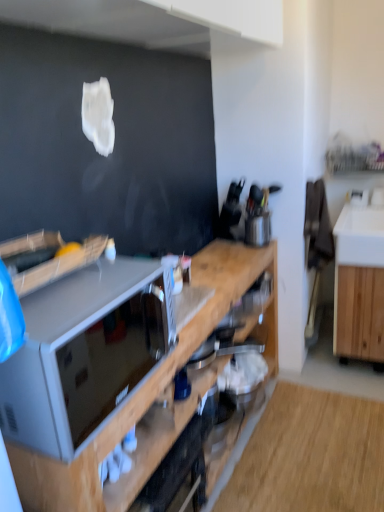
Question: From the image's perspective, is wooden cabinet at center, which appears as the first cabinetry when viewed from the left, above or below wooden cabinet at right, positioned as the 2th cabinetry in left-to-right order?

Choices:
 (A) above
 (B) below

Answer: (B)

Question: Is wooden cabinet at center, placed as the second cabinetry when sorted from right to left, taller or shorter than wooden cabinet at right, positioned as the 2th cabinetry in left-to-right order?

Choices:
 (A) short
 (B) tall

Answer: (B)

Question: Which object is positioned farthest from the wooden cabinet at center, which appears as the first cabinetry when viewed from the left?

Choices:
 (A) metallic silver knife block at upper center, the first appliance when ordered from back to front
 (B) metallic silver toaster at center, which is counted as the 1th appliance, starting from the left
 (C) matte gray microwave at center
 (D) wooden cabinet at right, positioned as the 2th cabinetry in left-to-right order

Answer: (D)

Question: Estimate the real-world distances between objects in this image. Which object is farther from the metallic silver toaster at center, which is the 2th appliance from back to front?

Choices:
 (A) matte gray microwave at center
 (B) wooden cabinet at right, positioned as the 2th cabinetry in left-to-right order
 (C) metallic silver knife block at upper center, the second appliance positioned from the bottom
 (D) wooden cabinet at center, which appears as the first cabinetry when viewed from the left

Answer: (B)